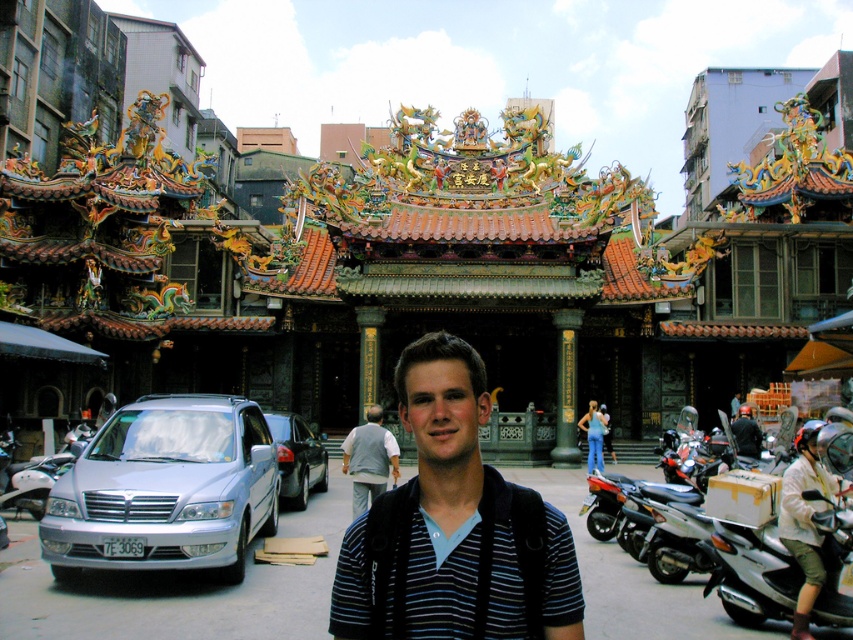
Does silver metallic van at left have a greater height compared to gray fabric pants at center?

Yes, silver metallic van at left is taller than gray fabric pants at center.

Identify the location of silver metallic van at left. (166, 490).

Is point (184, 464) farther from viewer compared to point (372, 433)?

No, it is not.

The image size is (853, 640). I want to click on silver metallic van at left, so click(x=166, y=490).

Is silver metallic van at left wider than shiny black sedan at center-left?

Yes, silver metallic van at left is wider than shiny black sedan at center-left.

Looking at this image, who is higher up, silver metallic van at left or shiny black sedan at center-left?

shiny black sedan at center-left is above.

Is point (73, 573) farther from viewer compared to point (271, 424)?

No, it is in front of (271, 424).

The height and width of the screenshot is (640, 853). Identify the location of silver metallic van at left. (166, 490).

Describe the element at coordinates (454, 525) in the screenshot. I see `blue striped shirt at center` at that location.

Does blue striped shirt at center appear on the right side of metallic silver motorcycle at lower right?

No, blue striped shirt at center is not to the right of metallic silver motorcycle at lower right.

Measure the distance between blue striped shirt at center and camera.

47.25 meters

Identify the location of blue striped shirt at center. (454, 525).